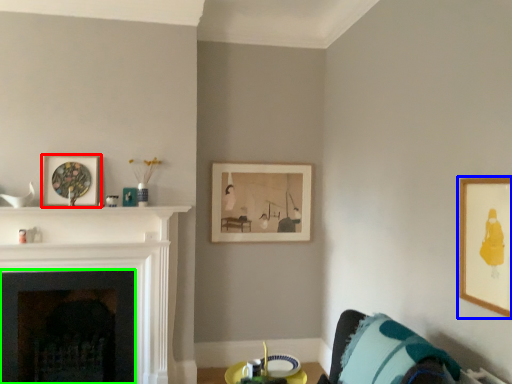
Question: Which object is positioned closest to picture frame (highlighted by a red box)? Select from picture frame (highlighted by a blue box) and fireplace (highlighted by a green box).

Choices:
 (A) picture frame
 (B) fireplace

Answer: (B)